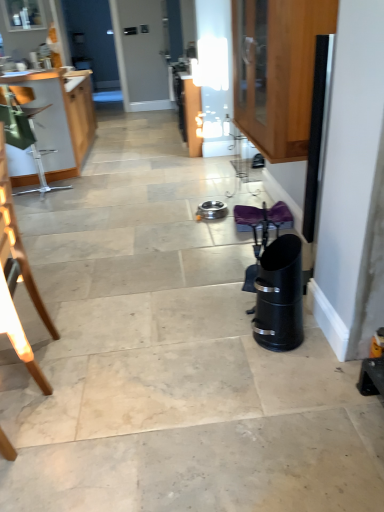
I want to click on free space in front of wooden chair at left, so 34,422.